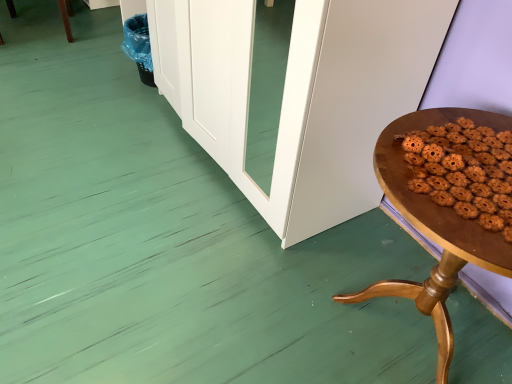
Question: Should I look upward or downward to see brown matte cookies at right?

Choices:
 (A) up
 (B) down

Answer: (A)

Question: Does brown matte cookies at right have a smaller size compared to wooden table at right?

Choices:
 (A) no
 (B) yes

Answer: (B)

Question: Does brown matte cookies at right contain wooden table at right?

Choices:
 (A) yes
 (B) no

Answer: (B)

Question: Would you say brown matte cookies at right is outside wooden table at right?

Choices:
 (A) no
 (B) yes

Answer: (A)

Question: Is brown matte cookies at right bigger than wooden table at right?

Choices:
 (A) no
 (B) yes

Answer: (A)

Question: Can you confirm if brown matte cookies at right is wider than wooden table at right?

Choices:
 (A) yes
 (B) no

Answer: (B)

Question: Is brown matte cookies at right facing towards wooden table at right?

Choices:
 (A) no
 (B) yes

Answer: (A)

Question: Would you say wooden table at right contains brown matte cookies at right?

Choices:
 (A) no
 (B) yes

Answer: (B)

Question: From the image's perspective, is wooden table at right over brown matte cookies at right?

Choices:
 (A) no
 (B) yes

Answer: (A)

Question: Is wooden table at right further to the viewer compared to brown matte cookies at right?

Choices:
 (A) yes
 (B) no

Answer: (B)

Question: Does wooden table at right have a greater width compared to brown matte cookies at right?

Choices:
 (A) no
 (B) yes

Answer: (B)

Question: Is wooden table at right not near brown matte cookies at right?

Choices:
 (A) no
 (B) yes

Answer: (A)

Question: Does wooden table at right appear on the right side of brown matte cookies at right?

Choices:
 (A) no
 (B) yes

Answer: (B)

Question: Based on their positions, is wooden table at right located to the left or right of brown matte cookies at right?

Choices:
 (A) right
 (B) left

Answer: (A)